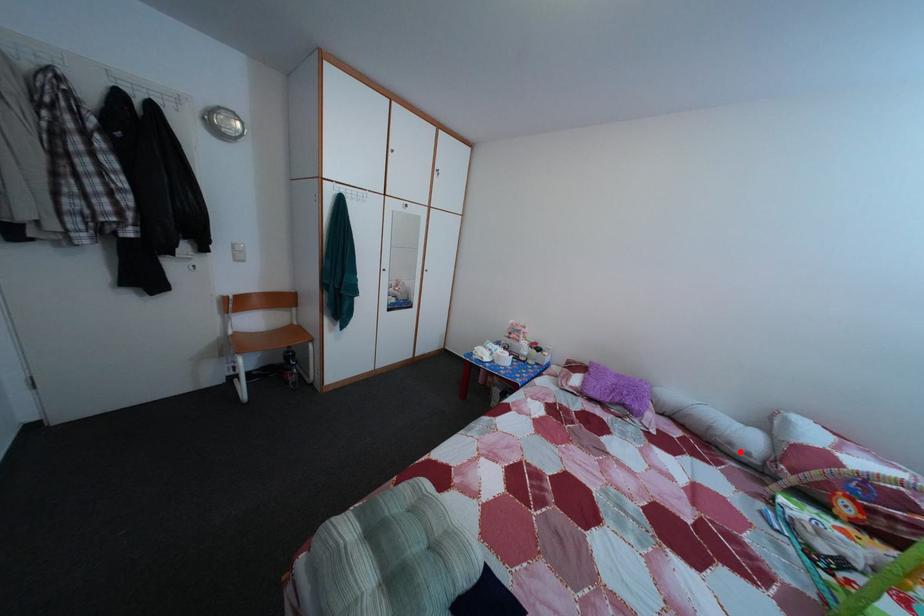
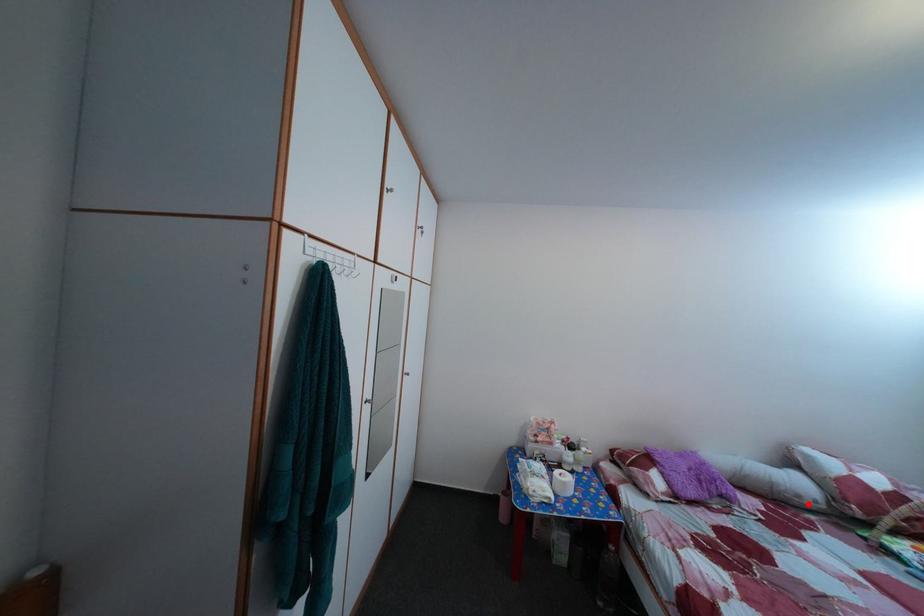
I am providing you with two images of the same scene from different viewpoints. A red point is marked on the first image and another point is marked on the second image. Is the marked point in image1 the same physical position as the marked point in image2?

Yes